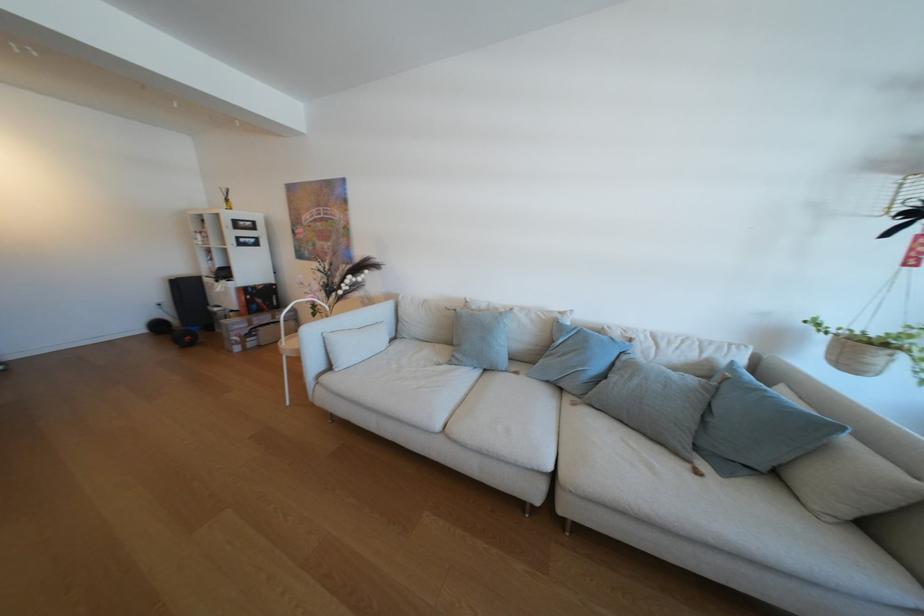
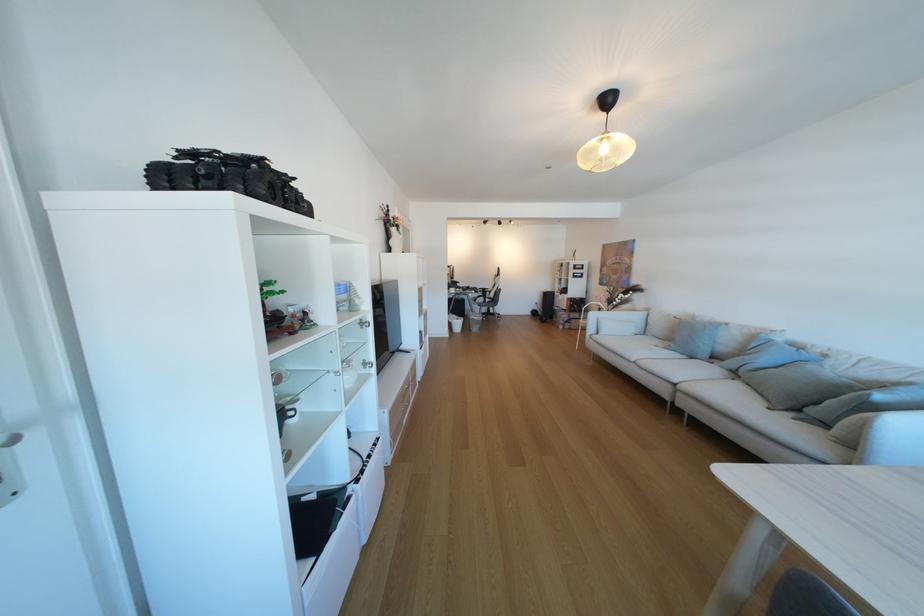
Locate, in the second image, the point that corresponds to pixel 275 309 in the first image.

(589, 310)